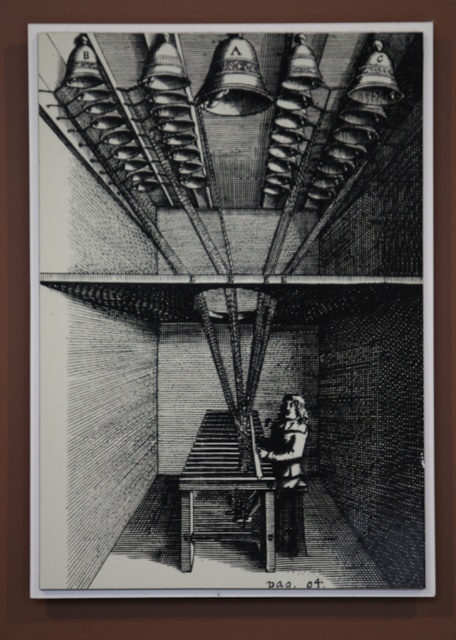
Who is higher up, dark brown wood figure at center or wooden stool at center?

dark brown wood figure at center is higher up.

Can you confirm if dark brown wood figure at center is taller than wooden stool at center?

Yes, dark brown wood figure at center is taller than wooden stool at center.

Identify the location of dark brown wood figure at center. This screenshot has width=456, height=640. (286, 461).

At what (x,y) coordinates should I click in order to perform the action: click on dark brown wood figure at center. Please return your answer as a coordinate pair (x, y). Looking at the image, I should click on (286, 461).